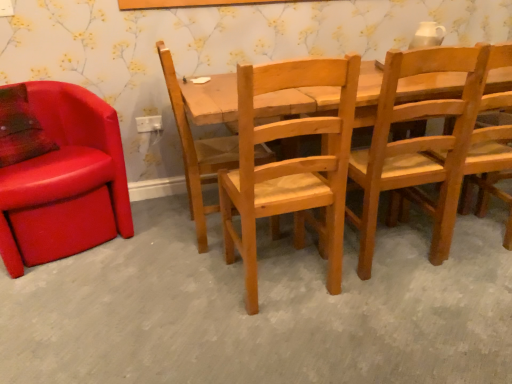
Image resolution: width=512 pixels, height=384 pixels. Find the location of `vacant space underneath natural wood chair at center, which is the third chair in right-to-left order (from a real-world perspective)`. vacant space underneath natural wood chair at center, which is the third chair in right-to-left order (from a real-world perspective) is located at coordinates (286, 276).